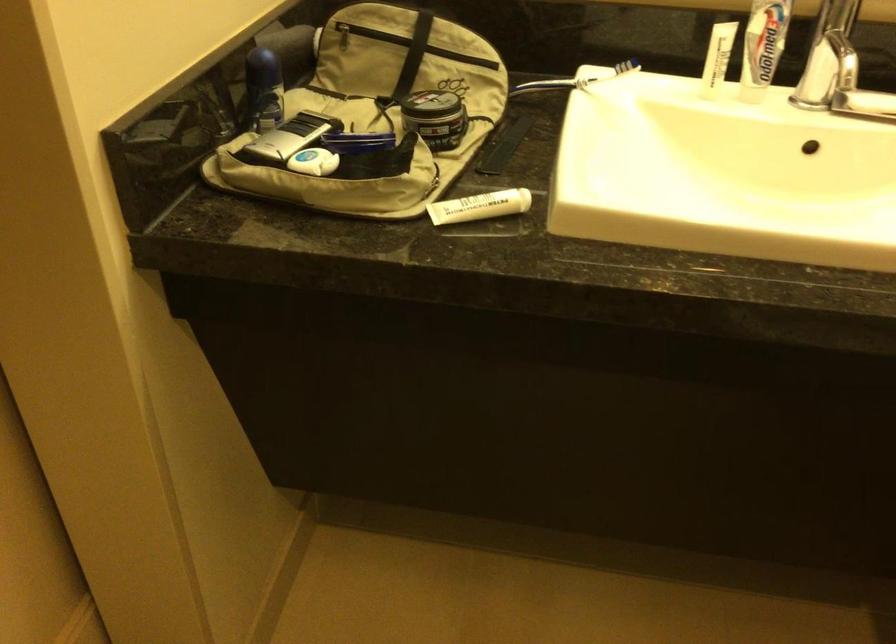
Where would you press the blue spray bottle? Please return your answer as a coordinate pair (x, y).

(263, 88)